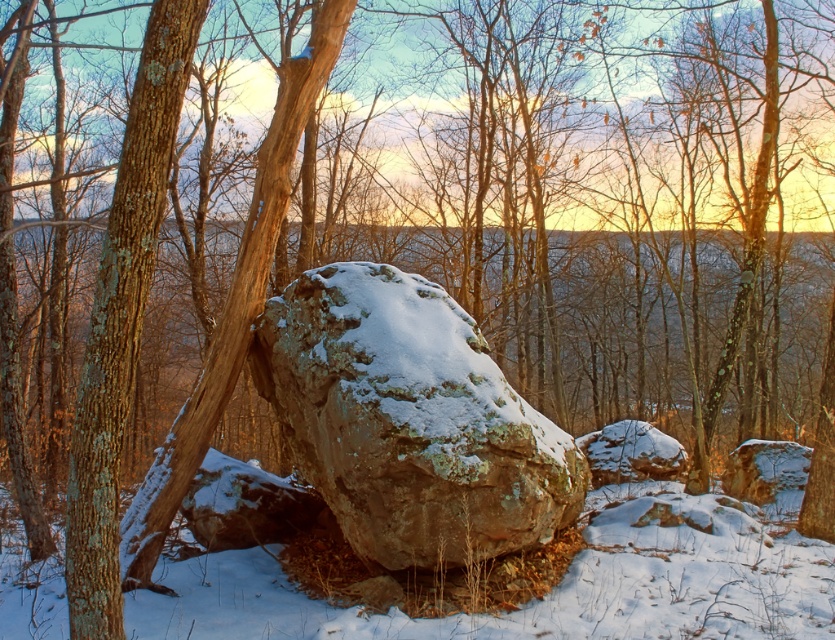
Is snowy gray rock at center to the left of smooth brown tree trunk at left from the viewer's perspective?

In fact, snowy gray rock at center is to the right of smooth brown tree trunk at left.

Who is more forward, (x=461, y=424) or (x=125, y=141)?

Point (x=125, y=141)

Locate an element on the screen. snowy gray rock at center is located at coordinates (408, 420).